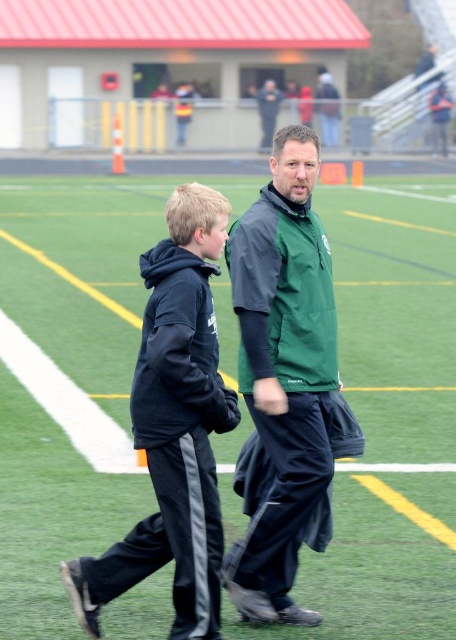
Question: Does green matte track at center lie behind green matte jacket at center?

Choices:
 (A) yes
 (B) no

Answer: (B)

Question: Which of these objects is positioned farthest from the black fleece jacket at center?

Choices:
 (A) green matte track at center
 (B) green matte jacket at center

Answer: (A)

Question: Which of the following is the farthest from the observer?

Choices:
 (A) green matte track at center
 (B) green matte jacket at center

Answer: (B)

Question: Is green matte jacket at center closer to camera compared to black fleece jacket at center?

Choices:
 (A) yes
 (B) no

Answer: (B)

Question: Can you confirm if green matte jacket at center is positioned above black fleece jacket at center?

Choices:
 (A) yes
 (B) no

Answer: (A)

Question: Which object is closer to the camera taking this photo?

Choices:
 (A) black fleece jacket at center
 (B) green matte jacket at center

Answer: (A)